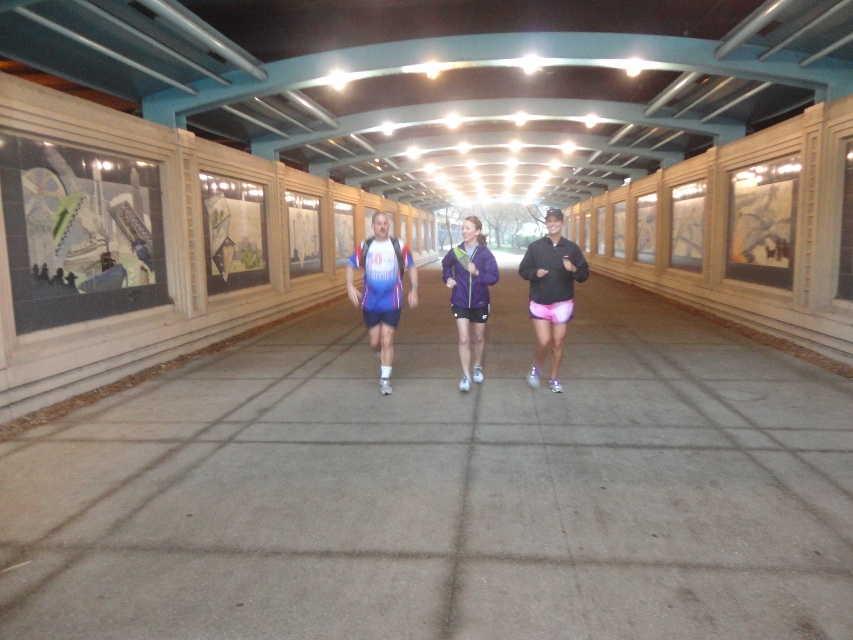
Question: Which point is farther to the camera?

Choices:
 (A) (462, 317)
 (B) (567, 282)

Answer: (A)

Question: Which object is the closest to the pink fabric shorts at center?

Choices:
 (A) purple matte jacket at center
 (B) matte blue and white running shirt at center

Answer: (A)

Question: In this image, where is pink fabric shorts at center located relative to matte blue and white running shirt at center?

Choices:
 (A) right
 (B) left

Answer: (A)

Question: Considering the relative positions of matte blue and white running shirt at center and purple matte jacket at center in the image provided, where is matte blue and white running shirt at center located with respect to purple matte jacket at center?

Choices:
 (A) right
 (B) left

Answer: (B)

Question: Can you confirm if matte blue and white running shirt at center is positioned below purple matte jacket at center?

Choices:
 (A) no
 (B) yes

Answer: (A)

Question: Which of the following is the closest to the observer?

Choices:
 (A) (561, 321)
 (B) (451, 275)
 (C) (383, 289)

Answer: (A)